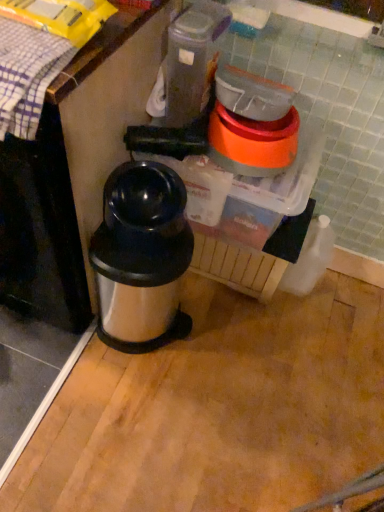
At what (x,y) coordinates should I click in order to perform the action: click on vacant space to the right of silver metallic thermos at center. Please return your answer as a coordinate pair (x, y). Image resolution: width=384 pixels, height=512 pixels. Looking at the image, I should click on (226, 340).